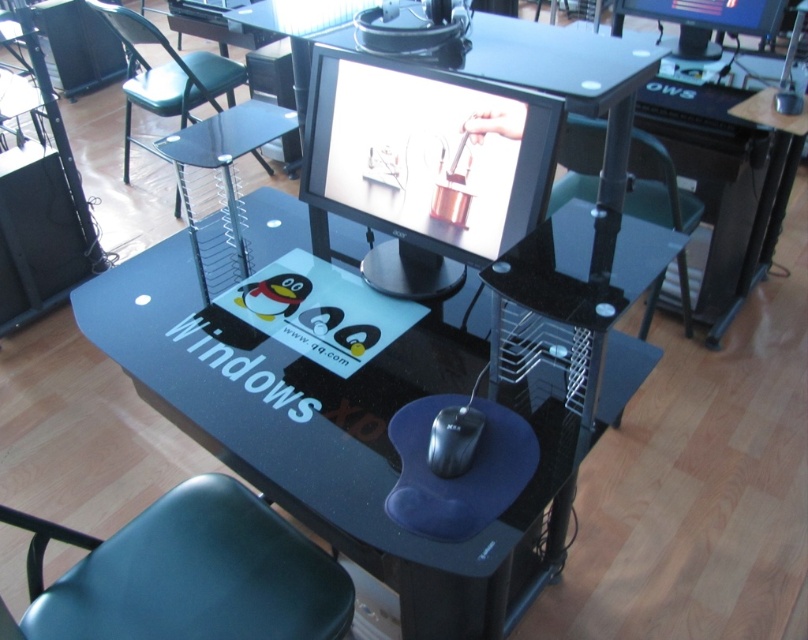
Question: Can you confirm if matte black monitor at center is bigger than matte black monitor at upper center?

Choices:
 (A) yes
 (B) no

Answer: (A)

Question: Does green plastic chair at upper left have a lesser width compared to matte black monitor at upper center?

Choices:
 (A) no
 (B) yes

Answer: (A)

Question: Which point is farther from the camera taking this photo?

Choices:
 (A) (718, 58)
 (B) (428, 192)

Answer: (A)

Question: Which point is closer to the camera?

Choices:
 (A) (285, 560)
 (B) (567, 189)
 (C) (436, 470)

Answer: (C)

Question: Which object appears closest to the camera in this image?

Choices:
 (A) black plastic chair at center
 (B) black matte mouse at center
 (C) matte black monitor at center
 (D) transparent glass desk at center

Answer: (D)

Question: Is matte black monitor at center above black plastic chair at center?

Choices:
 (A) no
 (B) yes

Answer: (A)